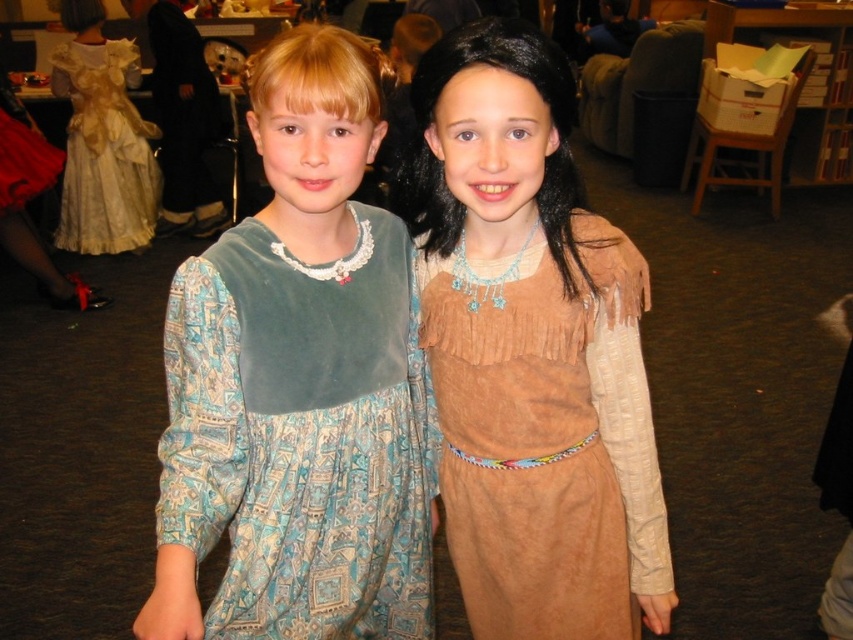
Is velvet dress at left taller than gold lace dress at upper left?

No.

Can you confirm if velvet dress at left is wider than gold lace dress at upper left?

Incorrect, velvet dress at left's width does not surpass gold lace dress at upper left's.

Locate an element on the screen. velvet dress at left is located at coordinates (299, 384).

Can you confirm if velvet dress at left is thinner than suede-like brown dress at center?

Yes, velvet dress at left is thinner than suede-like brown dress at center.

Does velvet dress at left appear over suede-like brown dress at center?

No.

Between point (270, 97) and point (555, 80), which one is positioned behind?

The point (555, 80) is behind.

What are the coordinates of `velvet dress at left` in the screenshot? It's located at (299, 384).

Who is lower down, suede-like brown dress at center or gold lace dress at upper left?

suede-like brown dress at center is lower down.

Between suede-like brown dress at center and gold lace dress at upper left, which one appears on the right side from the viewer's perspective?

suede-like brown dress at center

Is point (427, 177) positioned before point (137, 216)?

Yes, it is in front of point (137, 216).

This screenshot has width=853, height=640. Identify the location of suede-like brown dress at center. (531, 352).